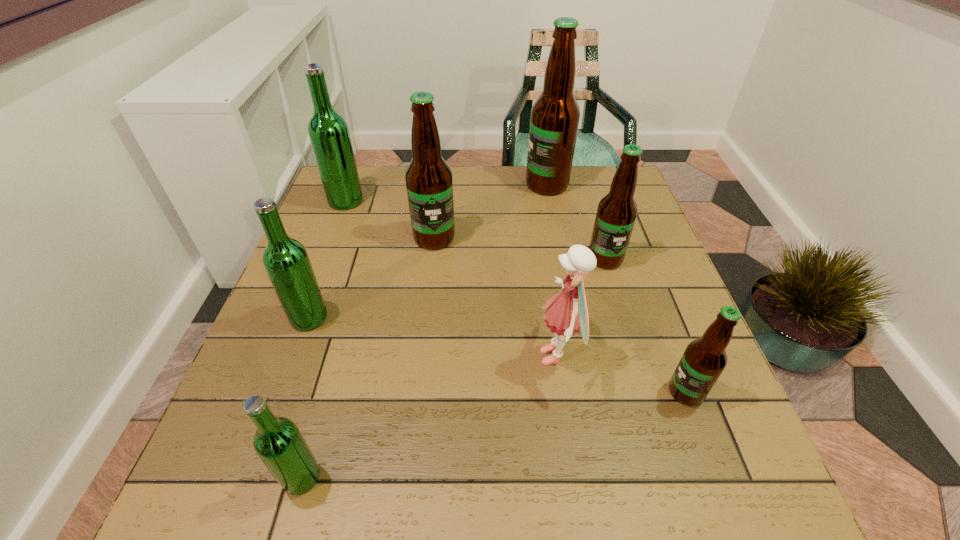
Select which green beer bottle appears as the closest to the nearest green beer bottle. Please provide its 2D coordinates. Your answer should be formatted as a tuple, i.e. [(x, y)], where the tuple contains the x and y coordinates of a point satisfying the conditions above.

[(286, 261)]

This screenshot has height=540, width=960. I want to click on green beer bottle that is the closest to the smallest green beer bottle, so click(286, 261).

At what (x,y) coordinates should I click in order to perform the action: click on free space that satisfies the following two spatial constraints: 1. on the label of the second nearest beer bottle; 2. on the front side of the nearest beer bottle. Please return your answer as a coordinate pair (x, y). The image size is (960, 540). Looking at the image, I should click on (718, 477).

I want to click on vacant space that satisfies the following two spatial constraints: 1. on the label of the biggest brown beer bottle; 2. on the label of the third smallest brown beer bottle, so click(558, 238).

Find the location of a particular element. This screenshot has height=540, width=960. free space that satisfies the following two spatial constraints: 1. on the label of the tallest object; 2. on the label of the fifth object from right to left is located at coordinates (558, 238).

In order to click on free space in the image that satisfies the following two spatial constraints: 1. on the label of the second smallest brown beer bottle; 2. on the front-facing side of the pink doll in this screenshot , I will do `click(635, 356)`.

At what (x,y) coordinates should I click in order to perform the action: click on free spot that satisfies the following two spatial constraints: 1. on the front-facing side of the doll; 2. on the front side of the rightmost green beer bottle. Please return your answer as a coordinate pair (x, y). Image resolution: width=960 pixels, height=540 pixels. Looking at the image, I should click on (576, 477).